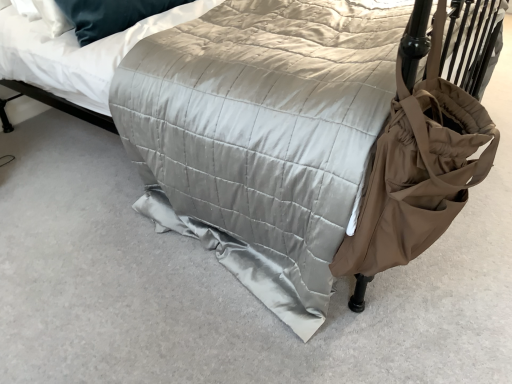
Question: Is brown fabric bag at right turned away from silky white mattress at upper center?

Choices:
 (A) yes
 (B) no

Answer: (A)

Question: Can you confirm if brown fabric bag at right is smaller than silky white mattress at upper center?

Choices:
 (A) no
 (B) yes

Answer: (B)

Question: Considering the relative positions of brown fabric bag at right and silky white mattress at upper center in the image provided, is brown fabric bag at right behind silky white mattress at upper center?

Choices:
 (A) yes
 (B) no

Answer: (B)

Question: From the image's perspective, is brown fabric bag at right beneath silky white mattress at upper center?

Choices:
 (A) yes
 (B) no

Answer: (A)

Question: From a real-world perspective, is brown fabric bag at right physically above silky white mattress at upper center?

Choices:
 (A) no
 (B) yes

Answer: (A)

Question: Considering the relative sizes of brown fabric bag at right and silky white mattress at upper center in the image provided, is brown fabric bag at right shorter than silky white mattress at upper center?

Choices:
 (A) yes
 (B) no

Answer: (B)

Question: From the image's perspective, is silky white mattress at upper center located beneath brown fabric bag at right?

Choices:
 (A) yes
 (B) no

Answer: (B)

Question: Is silky white mattress at upper center to the right of brown fabric bag at right from the viewer's perspective?

Choices:
 (A) no
 (B) yes

Answer: (A)

Question: From a real-world perspective, is silky white mattress at upper center physically above brown fabric bag at right?

Choices:
 (A) yes
 (B) no

Answer: (A)

Question: Does silky white mattress at upper center have a greater width compared to brown fabric bag at right?

Choices:
 (A) no
 (B) yes

Answer: (B)

Question: Is silky white mattress at upper center to the left of brown fabric bag at right from the viewer's perspective?

Choices:
 (A) no
 (B) yes

Answer: (B)

Question: From the image's perspective, is silky white mattress at upper center above brown fabric bag at right?

Choices:
 (A) yes
 (B) no

Answer: (A)

Question: Would you say silky white mattress at upper center is inside or outside brown fabric bag at right?

Choices:
 (A) inside
 (B) outside

Answer: (B)